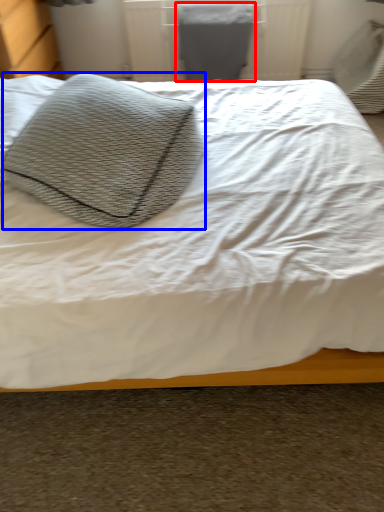
Question: Which point is further to the camera, gray (highlighted by a red box) or throw pillow (highlighted by a blue box)?

Choices:
 (A) gray
 (B) throw pillow

Answer: (A)